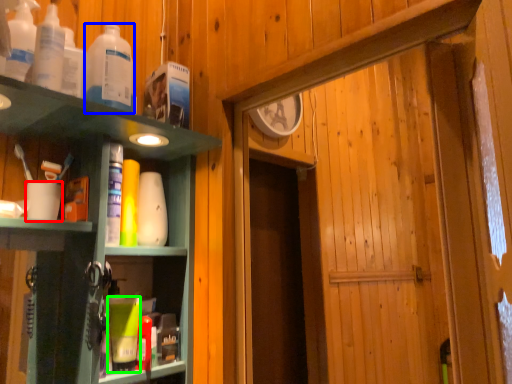
Question: Considering the real-world distances, which object is farthest from coffee cup (highlighted by a red box)? bottle (highlighted by a blue box) or toiletry (highlighted by a green box)?

Choices:
 (A) bottle
 (B) toiletry

Answer: (B)